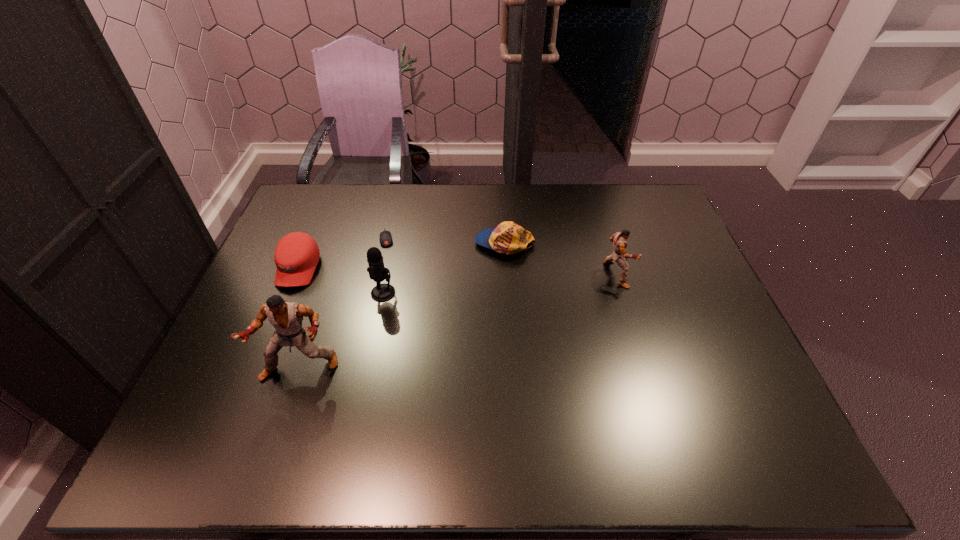
Locate an element on the screen. the nearer puncher is located at coordinates (286, 317).

At what (x,y) coordinates should I click in order to perform the action: click on the left puncher. Please return your answer as a coordinate pair (x, y). The height and width of the screenshot is (540, 960). Looking at the image, I should click on (286, 317).

Where is `the right puncher`? The width and height of the screenshot is (960, 540). the right puncher is located at coordinates (619, 241).

Where is `the shorter puncher`? the shorter puncher is located at coordinates (619, 241).

Where is `the fifth object from left to right`? the fifth object from left to right is located at coordinates (509, 238).

Identify the location of microphone. (383, 292).

At what (x,y) coordinates should I click in order to perform the action: click on the left cap. Please return your answer as a coordinate pair (x, y). Looking at the image, I should click on (296, 255).

Locate an element on the screen. This screenshot has height=540, width=960. computer mouse is located at coordinates (385, 238).

The height and width of the screenshot is (540, 960). What are the coordinates of `free space located 0.060m on the front-facing side of the nearest object` in the screenshot? It's located at (286, 409).

I want to click on free spot located 0.180m on the front-facing side of the rightmost object, so click(689, 274).